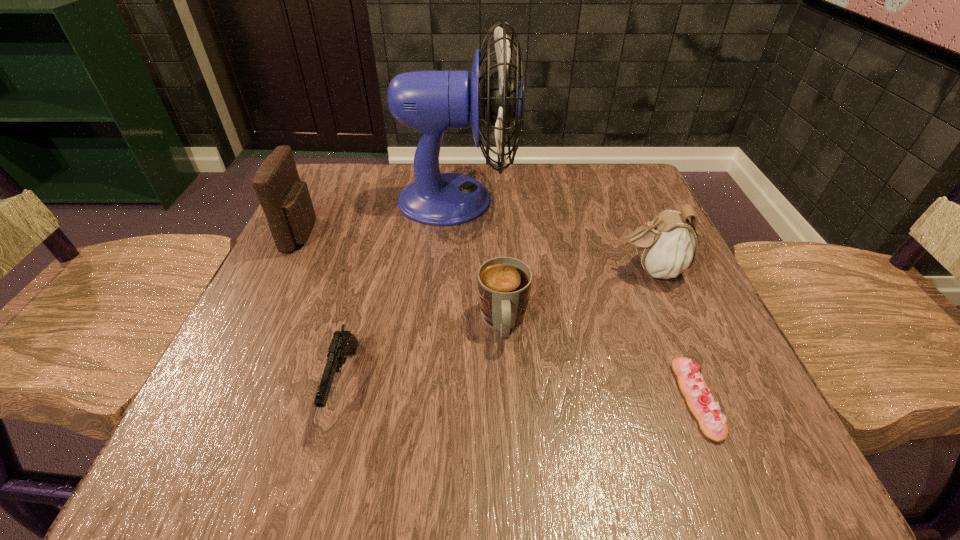
This screenshot has height=540, width=960. Find the location of `free space located on the front-facing side of the third tallest object`. free space located on the front-facing side of the third tallest object is located at coordinates (526, 270).

At what (x,y) coordinates should I click in order to perform the action: click on vacant space located 0.230m on the front-facing side of the third tallest object. Please return your answer as a coordinate pair (x, y). Looking at the image, I should click on (493, 270).

Where is `vacant space located 0.340m on the front-facing side of the third tallest object`? Image resolution: width=960 pixels, height=540 pixels. vacant space located 0.340m on the front-facing side of the third tallest object is located at coordinates (434, 270).

This screenshot has width=960, height=540. I want to click on vacant space situated on the side of the mug with the handle, so click(511, 470).

Locate an element on the screen. free spot located at the end of the barrel of the second object from left to right is located at coordinates (321, 469).

I want to click on vacant space located 0.060m on the back of the shortest object, so click(x=669, y=329).

Identify the location of fan that is at the far edge. (432, 102).

Where is `pouch that is at the far edge`? Image resolution: width=960 pixels, height=540 pixels. pouch that is at the far edge is located at coordinates (285, 199).

The height and width of the screenshot is (540, 960). In order to click on gun that is at the near edge in this screenshot , I will do [343, 343].

Find the location of `eclair located at the near edge`. eclair located at the near edge is located at coordinates (702, 404).